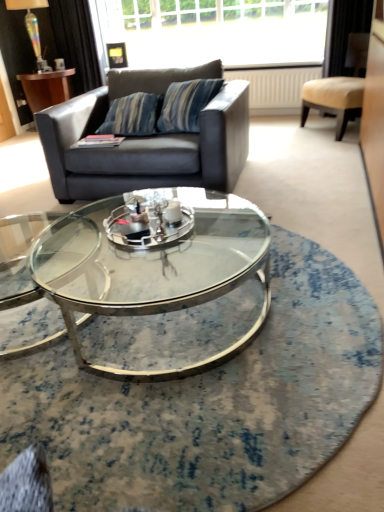
Question: Is clear glass coffee table at center inside or outside of black velvet curtain at upper left?

Choices:
 (A) outside
 (B) inside

Answer: (A)

Question: Considering the positions of clear glass coffee table at center and black velvet curtain at upper left in the image, is clear glass coffee table at center wider or thinner than black velvet curtain at upper left?

Choices:
 (A) thin
 (B) wide

Answer: (B)

Question: Estimate the real-world distances between objects in this image. Which object is farther from the dark gray fabric couch at upper left?

Choices:
 (A) clear glass window at upper center
 (B) iridescent glass lamp at upper left
 (C) brushed metal side table at upper left
 (D) beige leather chair at upper right
 (E) black velvet curtain at upper left

Answer: (B)

Question: Which object is positioned closest to the clear glass window at upper center?

Choices:
 (A) dark gray fabric couch at upper left
 (B) brushed metal side table at upper left
 (C) beige leather chair at upper right
 (D) black velvet curtain at upper left
 (E) iridescent glass lamp at upper left

Answer: (D)